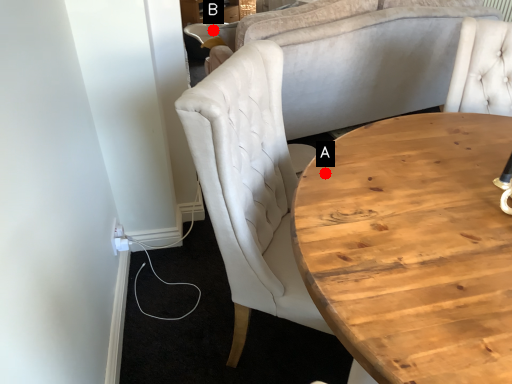
Question: Two points are circled on the image, labeled by A and B beside each circle. Which point is closer to the camera?

Choices:
 (A) A is closer
 (B) B is closer

Answer: (A)